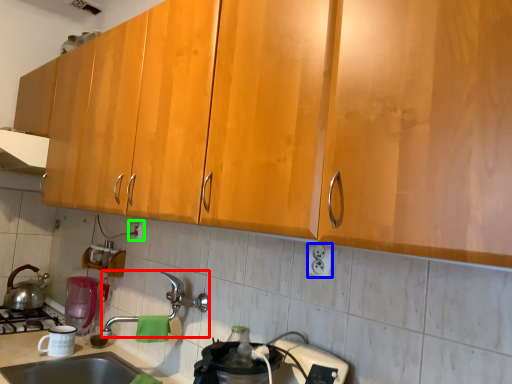
Question: Estimate the real-world distances between objects in this image. Which object is farther from faucet (highlighted by a red box), electric outlet (highlighted by a blue box) or electric outlet (highlighted by a green box)?

Choices:
 (A) electric outlet
 (B) electric outlet

Answer: (A)